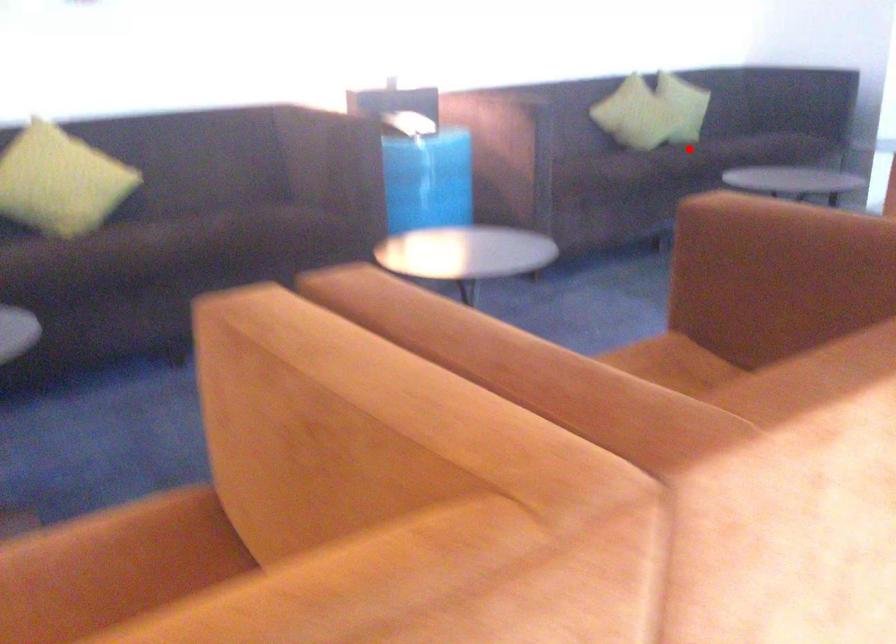
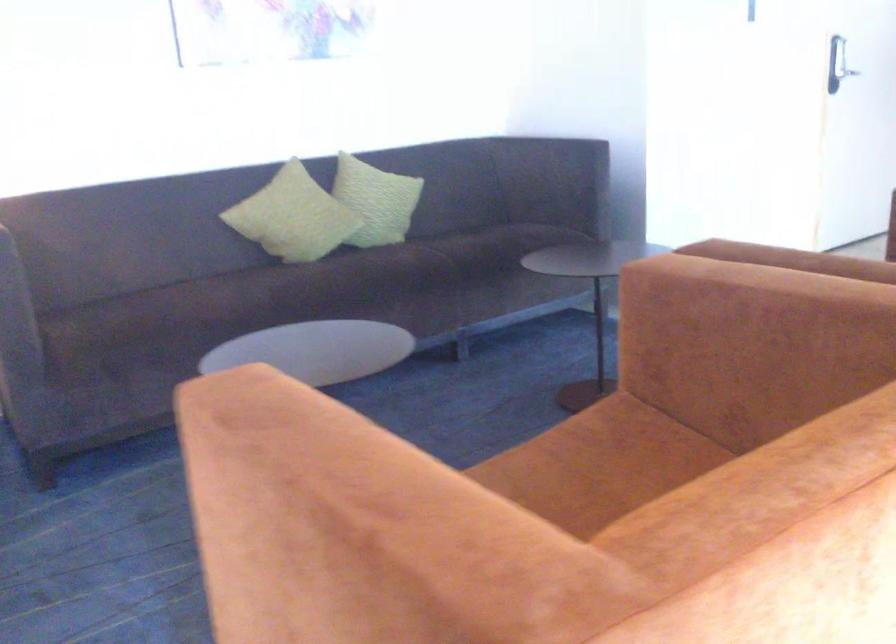
Where in the second image is the point corresponding to the highlighted location from the first image?

(270, 290)